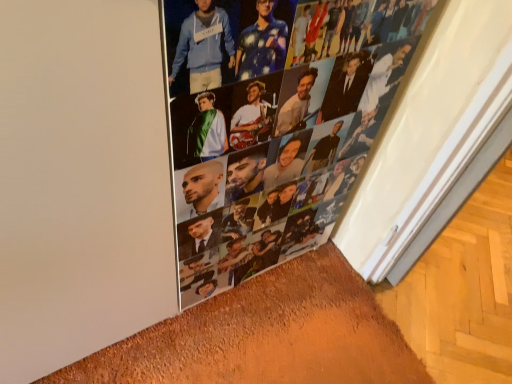
From the picture: Measure the distance between point [295,68] and camera.

26.30 inches.

What do you see at coordinates (285, 136) in the screenshot?
I see `printed photo collage at upper right` at bounding box center [285, 136].

Locate an element on the screen. The width and height of the screenshot is (512, 384). printed photo collage at upper right is located at coordinates (285, 136).

Find the location of a particular element. This screenshot has height=384, width=512. printed photo collage at upper right is located at coordinates (285, 136).